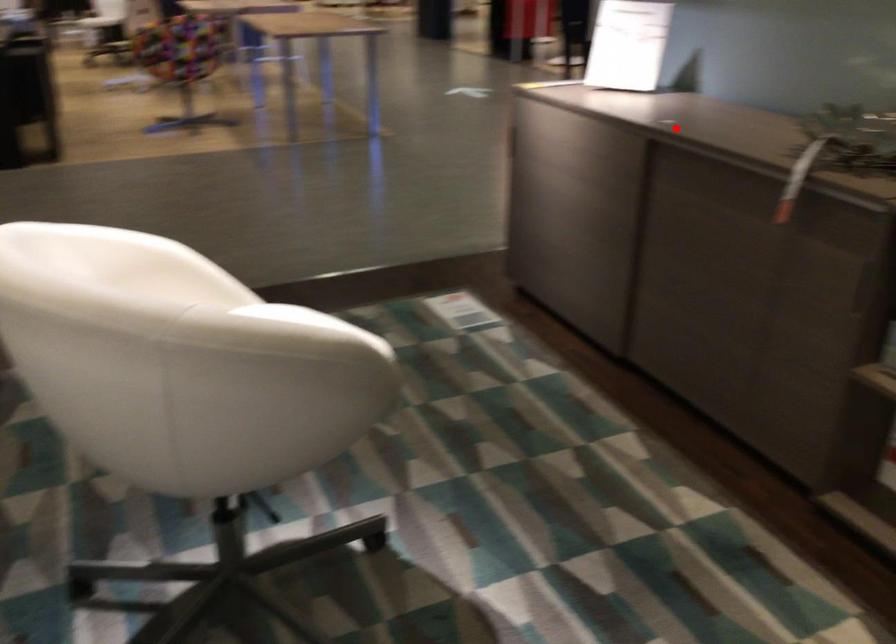
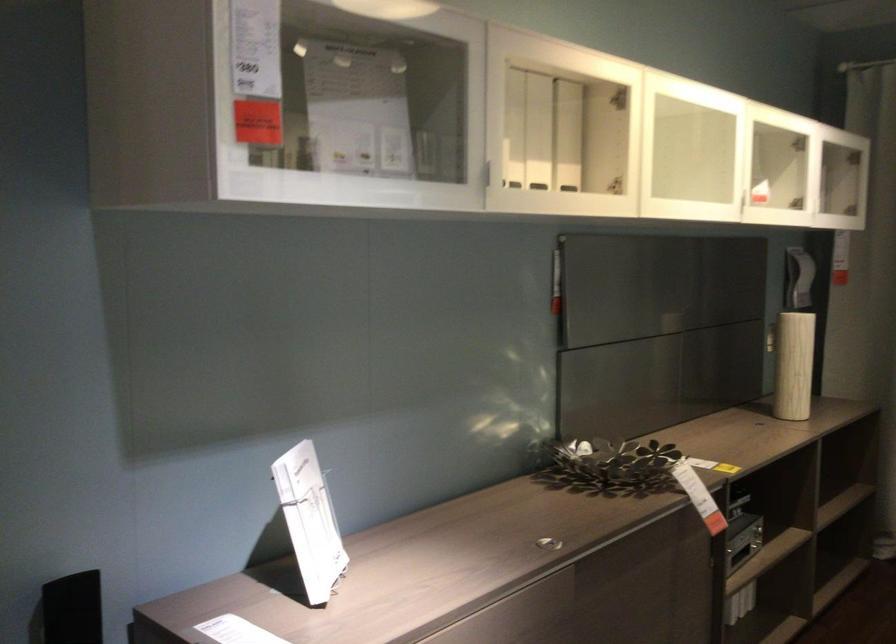
Question: I am providing you with two images of the same scene from different viewpoints. A red point is shown in image1. For the corresponding object point in image2, is it positioned nearer or farther from the camera?

Choices:
 (A) Nearer
 (B) Farther

Answer: (A)